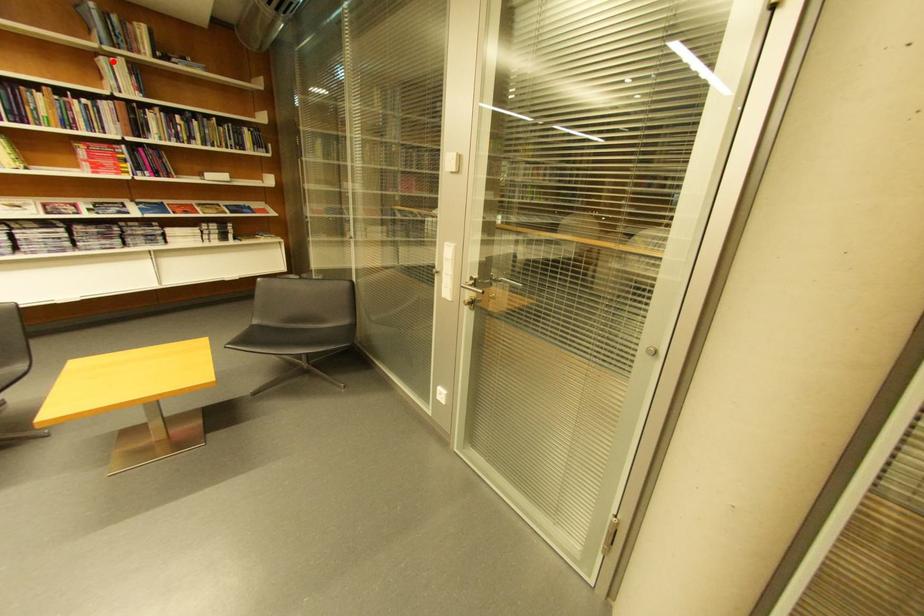
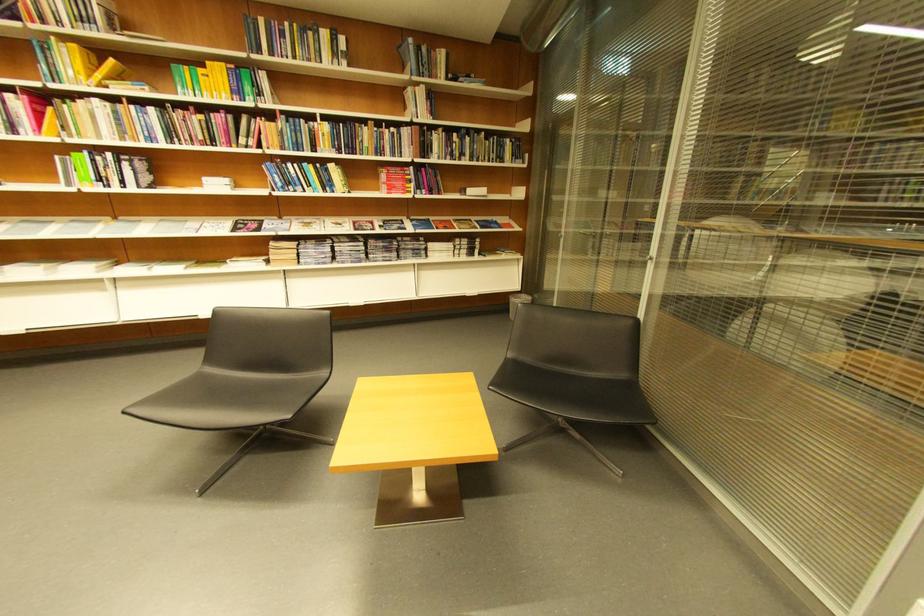
Question: A red point is marked in image1. In image2, is the corresponding 3D point closer to the camera or farther? Reply with the corresponding letter.

Choices:
 (A) The corresponding 3D point is closer.
 (B) The corresponding 3D point is farther.

Answer: (A)